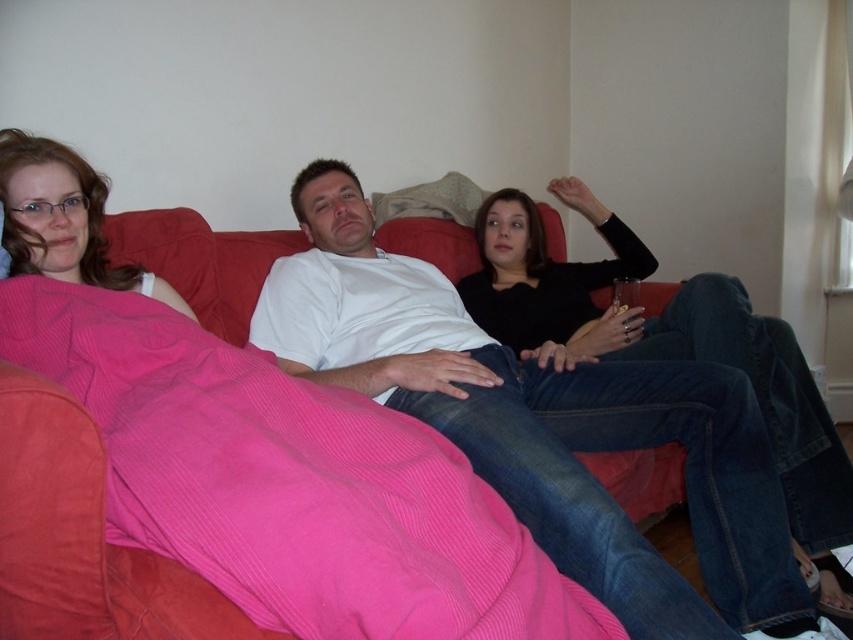
Question: Which point appears farthest from the camera in this image?

Choices:
 (A) (274, 560)
 (B) (495, 461)

Answer: (B)

Question: Can you confirm if pink corduroy blanket at upper left is smaller than white cotton shirt at center?

Choices:
 (A) yes
 (B) no

Answer: (A)

Question: Does pink corduroy blanket at upper left have a smaller size compared to white cotton shirt at center?

Choices:
 (A) yes
 (B) no

Answer: (A)

Question: In this image, where is pink corduroy blanket at upper left located relative to white cotton shirt at center?

Choices:
 (A) above
 (B) below

Answer: (B)